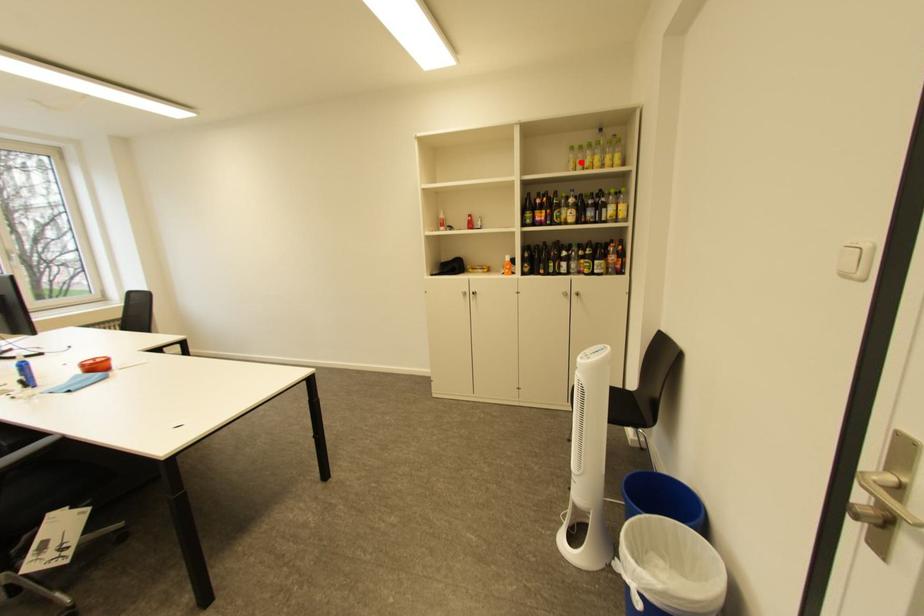
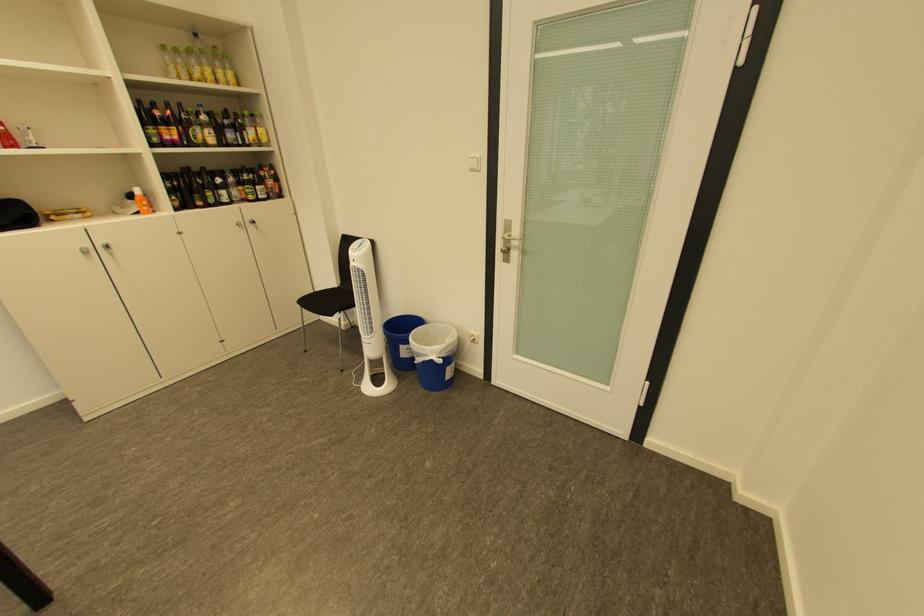
Question: I am providing you with two images of the same scene from different viewpoints. In image1, a red point is highlighted. Considering the same 3D point in image2, which of the following is correct?

Choices:
 (A) It is closer
 (B) It is farther

Answer: (B)